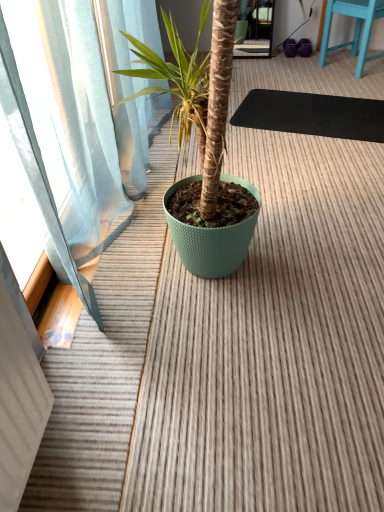
Question: Is blue painted wood chair at upper right bigger than black rubber yoga mat at center?

Choices:
 (A) no
 (B) yes

Answer: (B)

Question: Is blue painted wood chair at upper right turned away from black rubber yoga mat at center?

Choices:
 (A) yes
 (B) no

Answer: (A)

Question: From a real-world perspective, is blue painted wood chair at upper right physically below black rubber yoga mat at center?

Choices:
 (A) yes
 (B) no

Answer: (B)

Question: From the image's perspective, is blue painted wood chair at upper right beneath black rubber yoga mat at center?

Choices:
 (A) no
 (B) yes

Answer: (A)

Question: From the image's perspective, is blue painted wood chair at upper right above black rubber yoga mat at center?

Choices:
 (A) yes
 (B) no

Answer: (A)

Question: Can you confirm if blue painted wood chair at upper right is thinner than black rubber yoga mat at center?

Choices:
 (A) yes
 (B) no

Answer: (A)

Question: Can you confirm if black rubber yoga mat at center is shorter than blue painted wood chair at upper right?

Choices:
 (A) no
 (B) yes

Answer: (B)

Question: Is black rubber yoga mat at center bigger than blue painted wood chair at upper right?

Choices:
 (A) yes
 (B) no

Answer: (B)

Question: From a real-world perspective, is black rubber yoga mat at center over blue painted wood chair at upper right?

Choices:
 (A) yes
 (B) no

Answer: (B)

Question: Is there a large distance between black rubber yoga mat at center and blue painted wood chair at upper right?

Choices:
 (A) no
 (B) yes

Answer: (A)

Question: Is black rubber yoga mat at center looking in the opposite direction of blue painted wood chair at upper right?

Choices:
 (A) no
 (B) yes

Answer: (A)

Question: Considering the relative sizes of black rubber yoga mat at center and blue painted wood chair at upper right in the image provided, is black rubber yoga mat at center thinner than blue painted wood chair at upper right?

Choices:
 (A) yes
 (B) no

Answer: (B)

Question: From a real-world perspective, is blue painted wood chair at upper right physically located above or below black rubber yoga mat at center?

Choices:
 (A) above
 (B) below

Answer: (A)